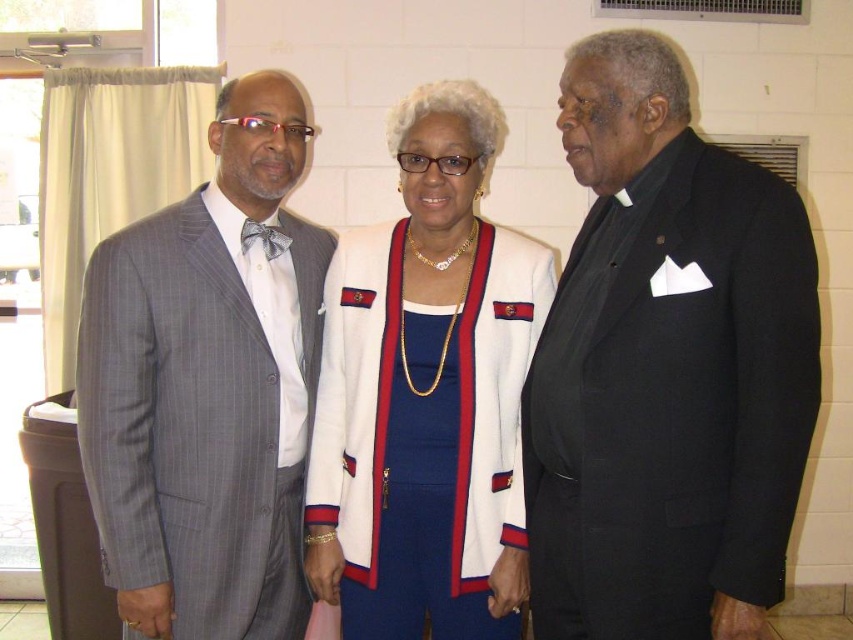
Looking at this image, does black satin suit at right appear on the left side of gray pinstripe suit at left?

No, black satin suit at right is not to the left of gray pinstripe suit at left.

Can you confirm if black satin suit at right is smaller than gray pinstripe suit at left?

Yes.

Is point (624, 180) farther from viewer compared to point (207, 525)?

No, (624, 180) is in front of (207, 525).

What are the coordinates of `black satin suit at right` in the screenshot? It's located at point(666,369).

Is point (250, 547) in front of point (412, 216)?

Yes.

Describe the element at coordinates (207, 385) in the screenshot. I see `gray pinstripe suit at left` at that location.

Where is `gray pinstripe suit at left`? This screenshot has width=853, height=640. gray pinstripe suit at left is located at coordinates (207, 385).

Which is behind, point (579, 243) or point (502, 296)?

Positioned behind is point (502, 296).

Between point (643, 45) and point (457, 163), which one is positioned in front?

Point (643, 45) is in front.

Where is `black satin suit at right`? The image size is (853, 640). black satin suit at right is located at coordinates (666, 369).